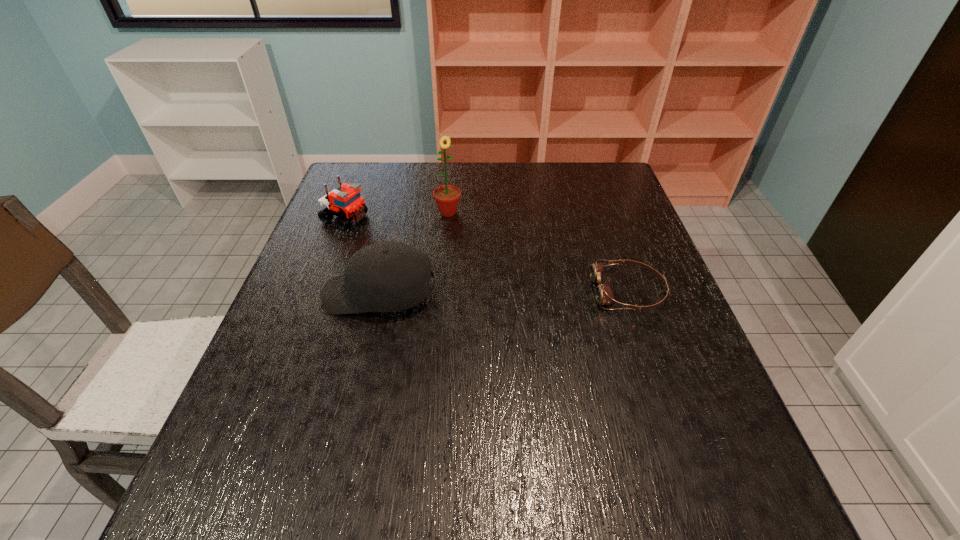
Image resolution: width=960 pixels, height=540 pixels. What are the coordinates of `free space located 0.160m on the face of the sunflower` in the screenshot? It's located at (468, 254).

Where is `blank space located 0.240m on the front-facing side of the Lego`? blank space located 0.240m on the front-facing side of the Lego is located at coordinates (435, 252).

Where is `vacant space located on the front-facing side of the Lego`? Image resolution: width=960 pixels, height=540 pixels. vacant space located on the front-facing side of the Lego is located at coordinates (404, 240).

At what (x,y) coordinates should I click in order to perform the action: click on vacant space located on the front-facing side of the Lego. Please return your answer as a coordinate pair (x, y). The width and height of the screenshot is (960, 540). Looking at the image, I should click on (416, 245).

Image resolution: width=960 pixels, height=540 pixels. What are the coordinates of `baseball cap that is positioned at the left edge` in the screenshot? It's located at (388, 276).

You are a GUI agent. You are given a task and a screenshot of the screen. Output one action in this format:
    pyautogui.click(x=<x>, y=<y>)
    Task: Click on the Lego positioned at the left edge
    
    Given the screenshot: What is the action you would take?
    pyautogui.click(x=347, y=204)

Locate an element on the screen. The width and height of the screenshot is (960, 540). object that is at the right edge is located at coordinates (604, 294).

Where is `vacant space at the far edge of the desktop`? Image resolution: width=960 pixels, height=540 pixels. vacant space at the far edge of the desktop is located at coordinates (528, 178).

You are a GUI agent. You are given a task and a screenshot of the screen. Output one action in this format:
    pyautogui.click(x=<x>, y=<y>)
    Task: Click on the vacant space at the near edge
    The image size is (960, 540).
    Given the screenshot: What is the action you would take?
    click(396, 435)

Where is `vacant space at the left edge of the desktop`? vacant space at the left edge of the desktop is located at coordinates (334, 230).